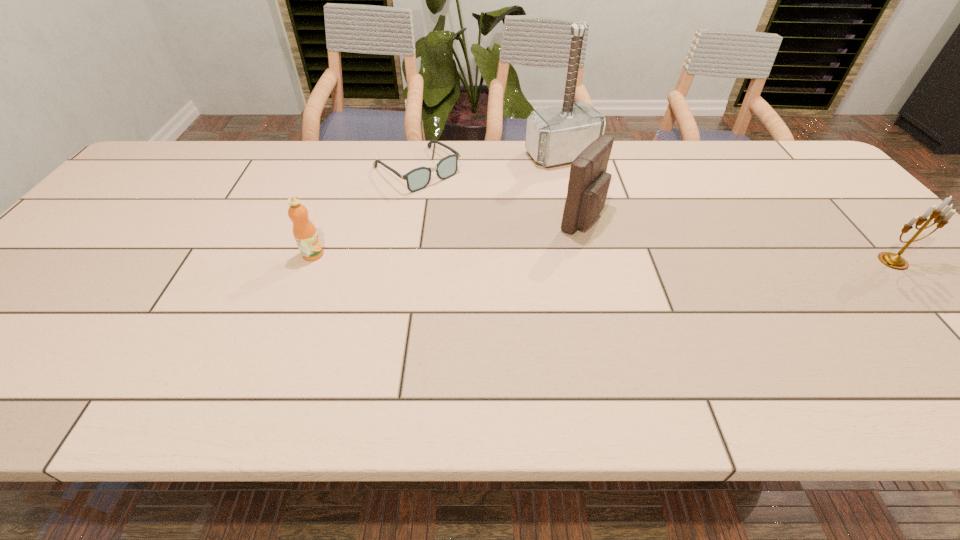
Locate an element on the screen. The width and height of the screenshot is (960, 540). free space that is in between the third nearest object and the shortest object is located at coordinates (499, 193).

I want to click on free space between the tallest object and the leftmost object, so (437, 205).

Locate an element on the screen. Image resolution: width=960 pixels, height=540 pixels. free spot between the hammer and the leftmost object is located at coordinates (437, 205).

Locate an element on the screen. The height and width of the screenshot is (540, 960). unoccupied position between the rightmost object and the tallest object is located at coordinates (727, 208).

Where is `object that is the third closest to the third nearest object`? This screenshot has width=960, height=540. object that is the third closest to the third nearest object is located at coordinates (304, 231).

Locate an element on the screen. object that is the second nearest to the third farthest object is located at coordinates [418, 178].

I want to click on vacant area in the image that satisfies the following two spatial constraints: 1. on the front side of the candelabrum; 2. on the right side of the pouch, so click(592, 261).